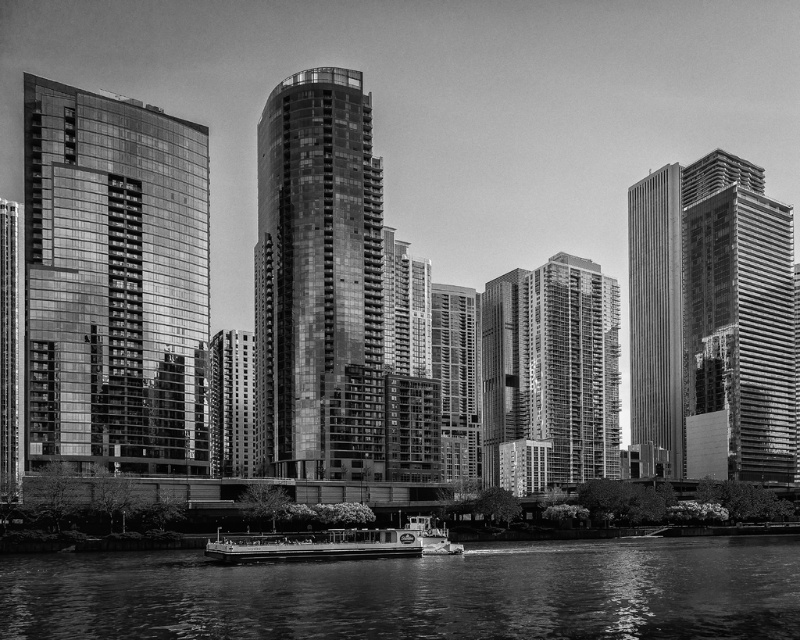
Does glossy glass building at center have a greater height compared to metallic polished boat at center?

Yes.

Between point (304, 360) and point (340, 529), which one is positioned in front?

Point (340, 529) is more forward.

Locate an element on the screen. This screenshot has width=800, height=640. glossy glass building at center is located at coordinates (320, 282).

Consider the image. Can you confirm if smooth glass building at center is positioned above smooth gray skyscraper at right?

Actually, smooth glass building at center is below smooth gray skyscraper at right.

Which is behind, point (556, 280) or point (656, 362)?

The point (556, 280) is behind.

At what (x,y) coordinates should I click in order to perform the action: click on smooth glass building at center. Please return your answer as a coordinate pair (x, y). This screenshot has height=640, width=800. Looking at the image, I should click on (550, 374).

Between smooth water at lower center and glassy reflective building at left, which one appears on the left side from the viewer's perspective?

From the viewer's perspective, glassy reflective building at left appears more on the left side.

Is point (16, 630) less distant than point (172, 460)?

Yes, point (16, 630) is closer to viewer.

Which is behind, point (608, 564) or point (92, 339)?

The point (92, 339) is more distant.

Where is `smooth water at lower center`? This screenshot has width=800, height=640. smooth water at lower center is located at coordinates (418, 593).